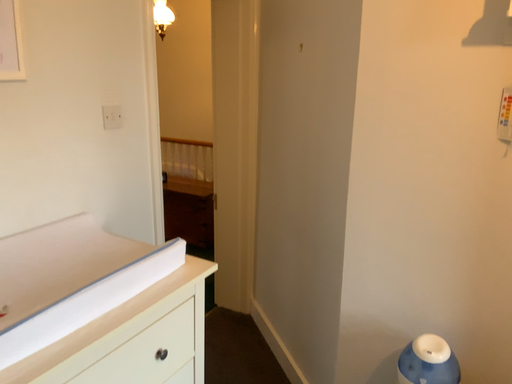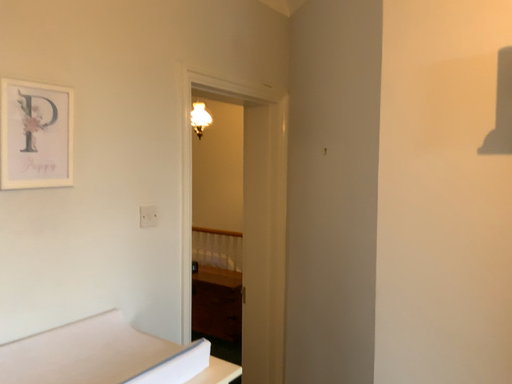
Question: How did the camera likely rotate when shooting the video?

Choices:
 (A) rotated upward
 (B) rotated downward

Answer: (A)